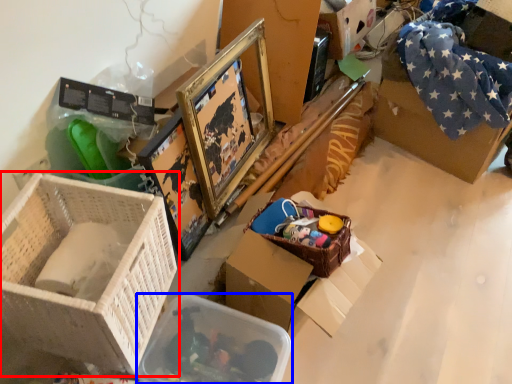
Question: Which object appears farthest to the camera in this image, box (highlighted by a red box) or storage box (highlighted by a blue box)?

Choices:
 (A) box
 (B) storage box

Answer: (B)